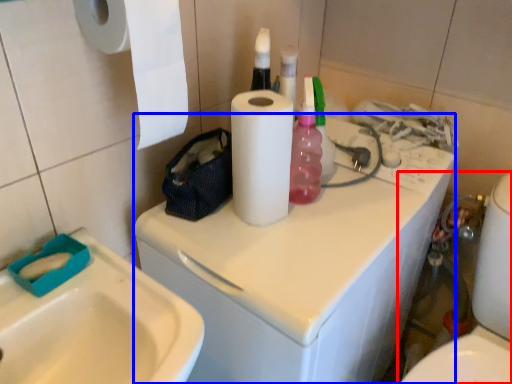
Question: Which point is further to the camera, toilet (highlighted by a red box) or washing machine (highlighted by a blue box)?

Choices:
 (A) toilet
 (B) washing machine

Answer: (A)